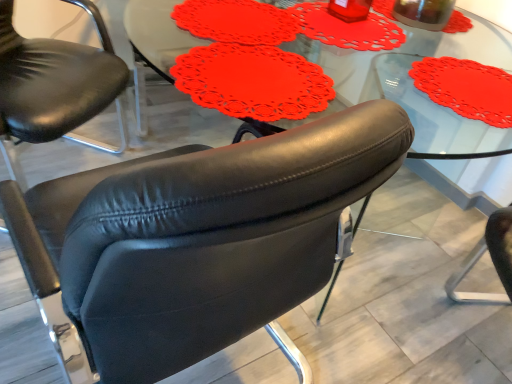
Question: Can you confirm if matte black armchair at center, acting as the first chair starting from the left, is wider than matte red doily at center?

Choices:
 (A) no
 (B) yes

Answer: (B)

Question: Could you tell me if matte black armchair at center, acting as the first chair starting from the left, is facing matte red doily at center?

Choices:
 (A) no
 (B) yes

Answer: (B)

Question: From a real-world perspective, does matte black armchair at center, which is the second chair from right to left, sit lower than matte red doily at center?

Choices:
 (A) no
 (B) yes

Answer: (B)

Question: Does matte black armchair at center, which is the second chair from right to left, have a larger size compared to matte red doily at center?

Choices:
 (A) no
 (B) yes

Answer: (B)

Question: Considering the relative sizes of matte black armchair at center, which is the second chair from right to left, and matte red doily at center in the image provided, is matte black armchair at center, which is the second chair from right to left, smaller than matte red doily at center?

Choices:
 (A) no
 (B) yes

Answer: (A)

Question: Would you consider matte black armchair at center, which is the second chair from right to left, to be distant from matte red doily at center?

Choices:
 (A) yes
 (B) no

Answer: (B)

Question: From a real-world perspective, is matte red doily at center positioned over matte black armchair at center, which is the second chair from right to left, based on gravity?

Choices:
 (A) yes
 (B) no

Answer: (A)

Question: From a real-world perspective, is matte red doily at center positioned under matte black armchair at center, acting as the first chair starting from the left, based on gravity?

Choices:
 (A) yes
 (B) no

Answer: (B)

Question: Considering the relative sizes of matte red doily at center and matte black armchair at center, acting as the first chair starting from the left, in the image provided, is matte red doily at center smaller than matte black armchair at center, acting as the first chair starting from the left,?

Choices:
 (A) yes
 (B) no

Answer: (A)

Question: Is matte red doily at center surrounding matte black armchair at center, acting as the first chair starting from the left?

Choices:
 (A) no
 (B) yes

Answer: (A)

Question: Is the depth of matte red doily at center greater than that of matte black armchair at center, acting as the first chair starting from the left?

Choices:
 (A) yes
 (B) no

Answer: (B)

Question: Does matte red doily at center have a greater height compared to matte black armchair at center, acting as the first chair starting from the left?

Choices:
 (A) no
 (B) yes

Answer: (A)

Question: Considering the relative sizes of matte red doily at center and black leather chair at center, which ranks as the 1th chair in right-to-left order, in the image provided, is matte red doily at center thinner than black leather chair at center, which ranks as the 1th chair in right-to-left order,?

Choices:
 (A) yes
 (B) no

Answer: (A)